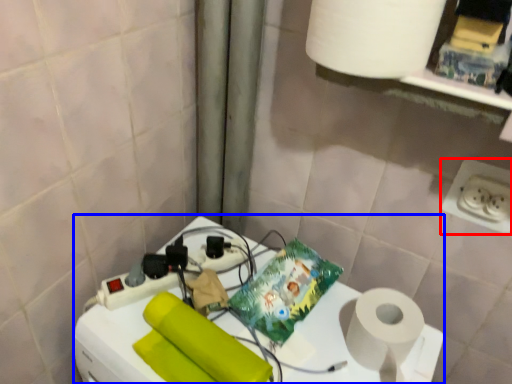
Question: Which point is further to the camera, power plugs and sockets (highlighted by a red box) or appliance (highlighted by a blue box)?

Choices:
 (A) power plugs and sockets
 (B) appliance

Answer: (A)